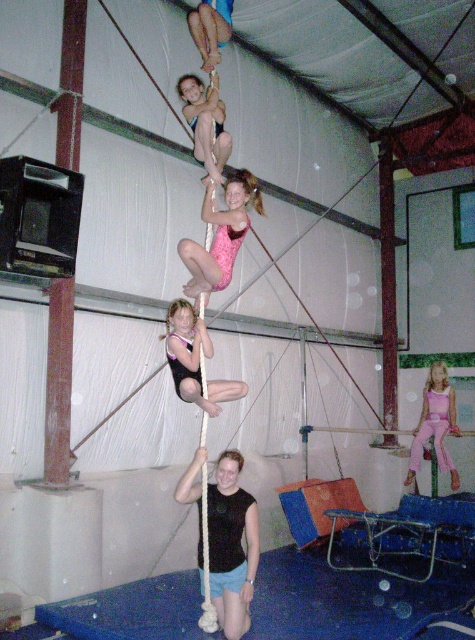
Does white fabric pole at upper center have a lesser height compared to matte black leotard at center?

Indeed, white fabric pole at upper center has a lesser height compared to matte black leotard at center.

Which is more to the right, white fabric pole at upper center or matte black leotard at center?

Positioned to the right is matte black leotard at center.

Who is more distant from viewer, (19,84) or (197,337)?

The point (19,84) is behind.

Image resolution: width=475 pixels, height=640 pixels. Find the location of `white fabric pole at upper center`. white fabric pole at upper center is located at coordinates (135, 132).

Which is below, pink leotard at center or pink fabric pole at center?

pink fabric pole at center is below.

Is pink leotard at center wider than pink fabric pole at center?

Yes.

Is point (230, 173) less distant than point (438, 436)?

Yes.

Locate an element on the screen. pink leotard at center is located at coordinates (220, 234).

Can you confirm if white fabric pole at upper center is positioned to the right of pink fabric pole at center?

Incorrect, white fabric pole at upper center is not on the right side of pink fabric pole at center.

Between white fabric pole at upper center and pink fabric pole at center, which one has less height?

Standing shorter between the two is white fabric pole at upper center.

Who is more forward, (x=369, y=236) or (x=420, y=435)?

Point (x=420, y=435) is more forward.

Where is `white fabric pole at upper center`? Image resolution: width=475 pixels, height=640 pixels. white fabric pole at upper center is located at coordinates (135, 132).